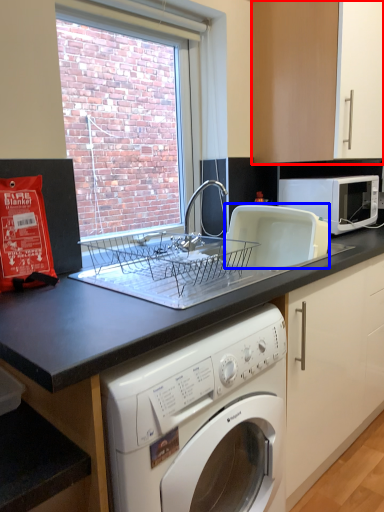
Question: Among these objects, which one is farthest to the camera, cabinetry (highlighted by a red box) or appliance (highlighted by a blue box)?

Choices:
 (A) cabinetry
 (B) appliance

Answer: (A)